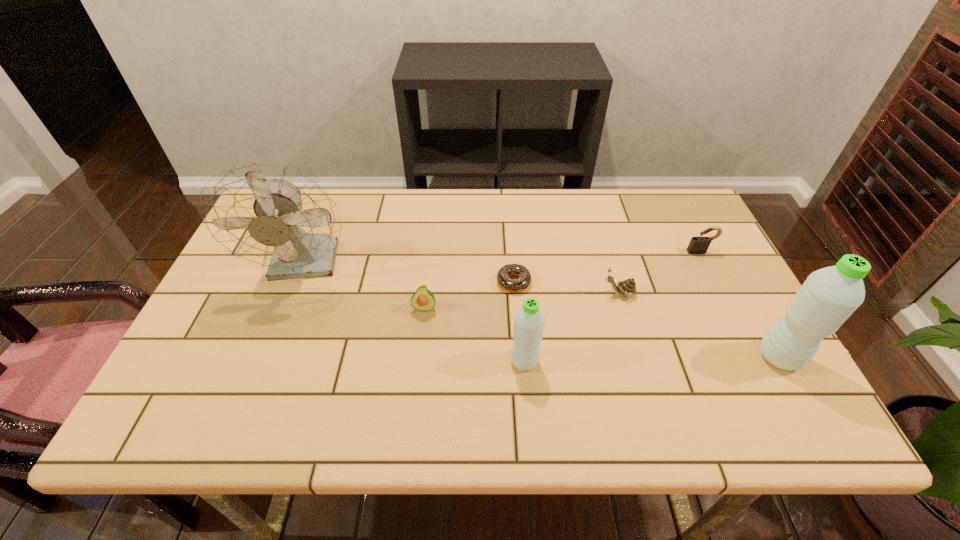
Locate an element on the screen. The image size is (960, 540). free space that satisfies the following two spatial constraints: 1. on the face of the snail; 2. on the front side of the third tallest object is located at coordinates (638, 361).

You are a GUI agent. You are given a task and a screenshot of the screen. Output one action in this format:
    pyautogui.click(x=<x>, y=<y>)
    Task: Click on the vacant space that satisfies the following two spatial constraints: 1. on the face of the taller water bottle; 2. on the right side of the snail
    This screenshot has height=540, width=960.
    Given the screenshot: What is the action you would take?
    pyautogui.click(x=637, y=357)

Image resolution: width=960 pixels, height=540 pixels. Find the location of `free space that satisfies the following two spatial constraints: 1. in front of the fifth shortest object to blow air; 2. on the right side of the fan`. free space that satisfies the following two spatial constraints: 1. in front of the fifth shortest object to blow air; 2. on the right side of the fan is located at coordinates (270, 361).

Locate an element on the screen. The width and height of the screenshot is (960, 540). vacant space that satisfies the following two spatial constraints: 1. in front of the leftmost object to blow air; 2. on the right side of the doughnut is located at coordinates (300, 282).

This screenshot has width=960, height=540. I want to click on vacant region that satisfies the following two spatial constraints: 1. on the cut side of the third tallest object; 2. on the right side of the sixth object from right to left, so click(419, 361).